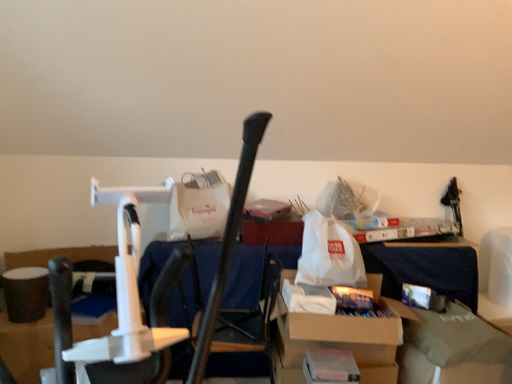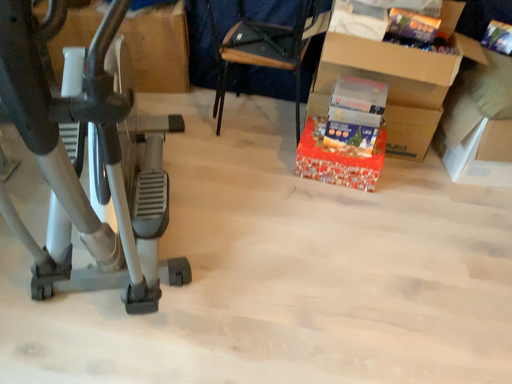
Question: How did the camera likely rotate when shooting the video?

Choices:
 (A) rotated downward
 (B) rotated upward

Answer: (A)